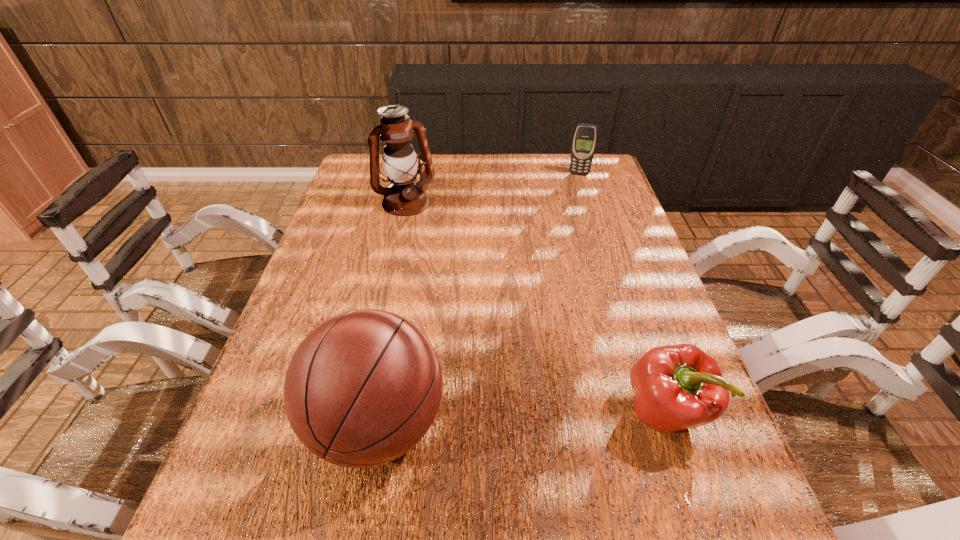
You are a GUI agent. You are given a task and a screenshot of the screen. Output one action in this format:
    pyautogui.click(x=<x>, y=<y>)
    Task: Click on the object present at the near left corner
    The height and width of the screenshot is (540, 960).
    Given the screenshot: What is the action you would take?
    pyautogui.click(x=363, y=388)

At what (x,y) coordinates should I click in order to perform the action: click on object present at the far right corner. Please return your answer as a coordinate pair (x, y). Looking at the image, I should click on (585, 136).

Where is `object present at the near right corner`? The height and width of the screenshot is (540, 960). object present at the near right corner is located at coordinates (677, 387).

Identify the location of vacant space at the far edge. (478, 177).

At what (x,y) coordinates should I click in order to perform the action: click on vacant space at the left edge. Please return your answer as a coordinate pair (x, y). This screenshot has height=540, width=960. Looking at the image, I should click on (369, 223).

I want to click on free region at the right edge of the desktop, so click(610, 211).

Locate an element on the screen. vacant area at the far right corner of the desktop is located at coordinates (612, 187).

The image size is (960, 540). I want to click on free point between the basketball and the farthest object, so click(478, 299).

You are a GUI agent. You are given a task and a screenshot of the screen. Output one action in this format:
    pyautogui.click(x=<x>, y=<y>)
    Task: Click on the free space between the third nearest object and the pepper
    
    Given the screenshot: What is the action you would take?
    pyautogui.click(x=536, y=307)

In order to click on free point between the pepper and the cellular telephone in this screenshot , I will do `click(622, 293)`.